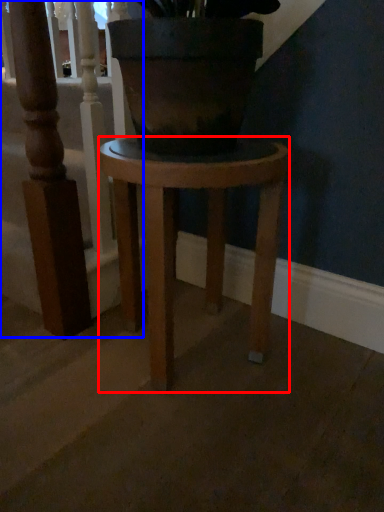
Question: Among these objects, which one is farthest to the camera, stool (highlighted by a red box) or rail (highlighted by a blue box)?

Choices:
 (A) stool
 (B) rail

Answer: (B)